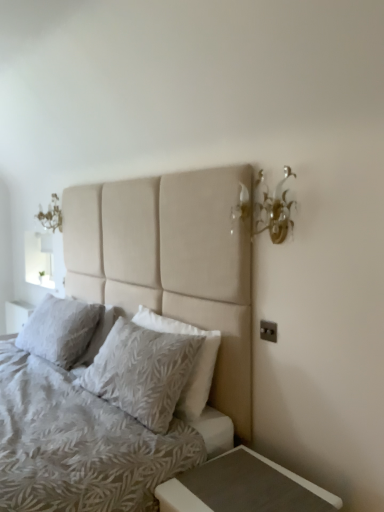
Question: Which direction should I rotate to look at white textured pillow at center, positioned as the second pillow in right-to-left order?

Choices:
 (A) right
 (B) left

Answer: (B)

Question: From the image's perspective, is white frosted glass at upper left beneath matte gray wood nightstand at lower right?

Choices:
 (A) no
 (B) yes

Answer: (A)

Question: Does white frosted glass at upper left touch matte gray wood nightstand at lower right?

Choices:
 (A) yes
 (B) no

Answer: (B)

Question: Is white frosted glass at upper left not within matte gray wood nightstand at lower right?

Choices:
 (A) no
 (B) yes

Answer: (B)

Question: Is white frosted glass at upper left further to the viewer compared to matte gray wood nightstand at lower right?

Choices:
 (A) no
 (B) yes

Answer: (B)

Question: Is matte gray wood nightstand at lower right located within white frosted glass at upper left?

Choices:
 (A) no
 (B) yes

Answer: (A)

Question: Does white frosted glass at upper left have a smaller size compared to matte gray wood nightstand at lower right?

Choices:
 (A) yes
 (B) no

Answer: (B)

Question: From the image's perspective, would you say gold metallic wall sconce at upper right is shown under beige fabric bed at center?

Choices:
 (A) no
 (B) yes

Answer: (A)

Question: Is gold metallic wall sconce at upper right thinner than beige fabric bed at center?

Choices:
 (A) no
 (B) yes

Answer: (B)

Question: Is there a large distance between gold metallic wall sconce at upper right and beige fabric bed at center?

Choices:
 (A) no
 (B) yes

Answer: (A)

Question: Does gold metallic wall sconce at upper right have a greater height compared to beige fabric bed at center?

Choices:
 (A) yes
 (B) no

Answer: (B)

Question: Does gold metallic wall sconce at upper right appear on the right side of beige fabric bed at center?

Choices:
 (A) yes
 (B) no

Answer: (A)

Question: Is gold metallic wall sconce at upper right oriented away from beige fabric bed at center?

Choices:
 (A) no
 (B) yes

Answer: (B)

Question: Does textured beige pillow at center, placed as the 2th pillow when sorted from left to right, contain white textured pillow at center, acting as the 1th pillow starting from the back?

Choices:
 (A) no
 (B) yes

Answer: (A)